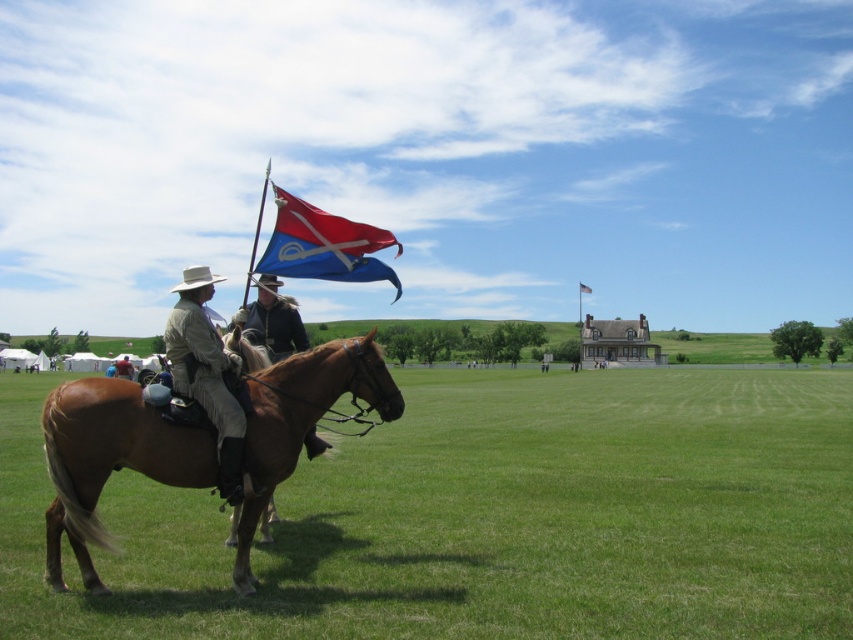
You are a photographer trying to capture a clear shot of the blue fabric flag at center and the dark brown leather jacket at center. Which object should you focus on first if you want to ensure both are in focus without moving the camera?

You should focus on the blue fabric flag at center first because it is closer to the camera than the dark brown leather jacket at center, so focusing on the closer object will ensure both are in focus when using depth of field.

You are a photographer trying to capture the best shot of the two points in the scene. Which point, point (286, 339) or point (115, 372), appears closer to you in the image?

Point (286, 339) is closer to the camera than point (115, 372), so it appears closer to you in the image.